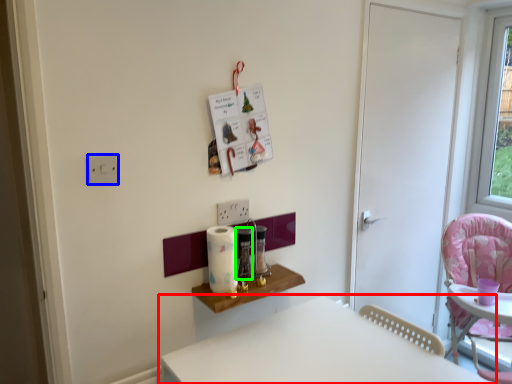
Question: Which object is the closest to the table (highlighted by a red box)? Choose among these: electric outlet (highlighted by a blue box) or appliance (highlighted by a green box).

Choices:
 (A) electric outlet
 (B) appliance

Answer: (B)